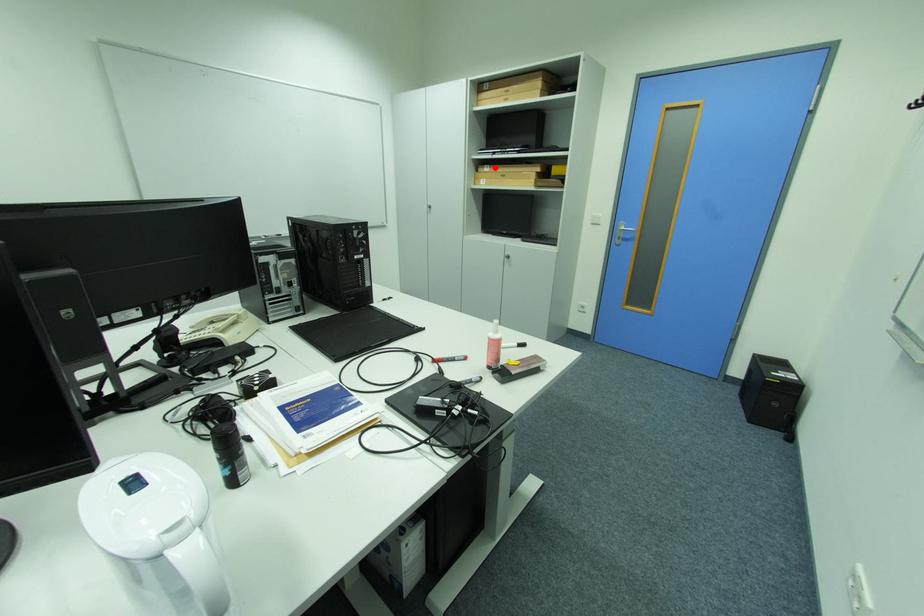
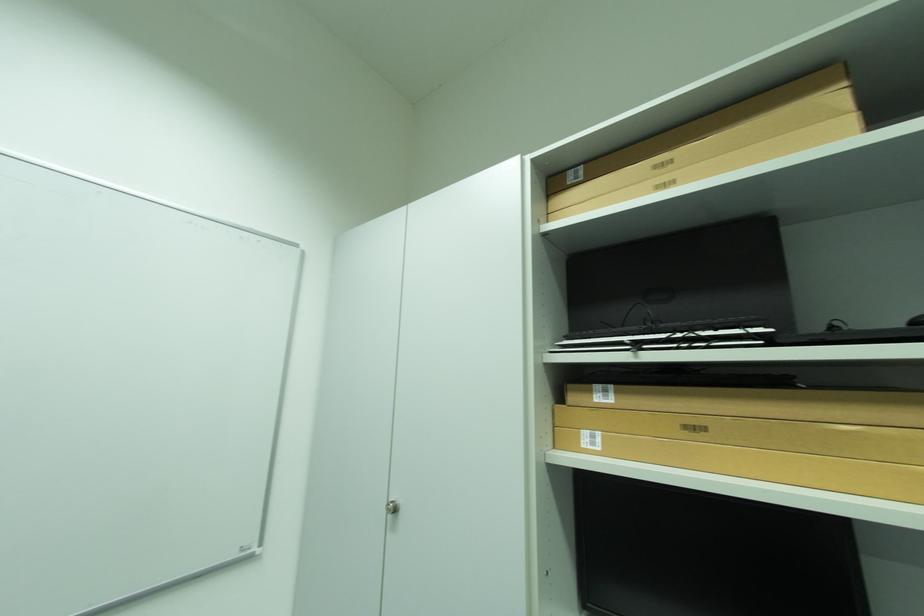
Question: I am providing you with two images of the same scene from different viewpoints. In image1, a red point is highlighted. Considering the same 3D point in image2, which of the following is correct?

Choices:
 (A) It is closer
 (B) It is farther

Answer: (B)